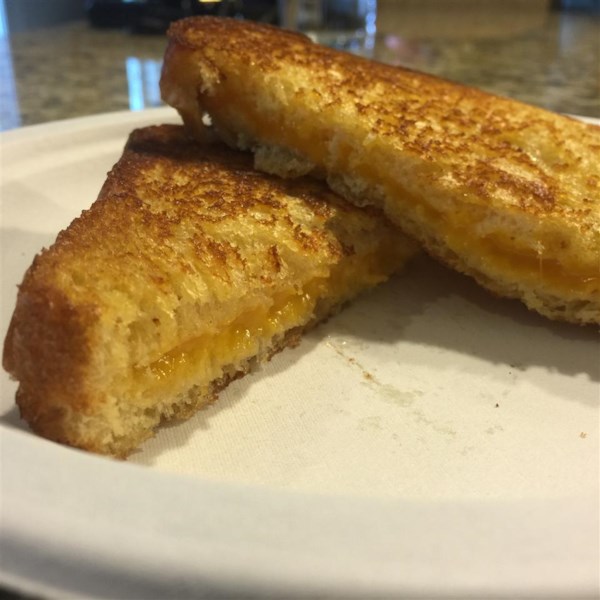
Find the location of a particular element. This screenshot has width=600, height=600. floor is located at coordinates (477, 21).